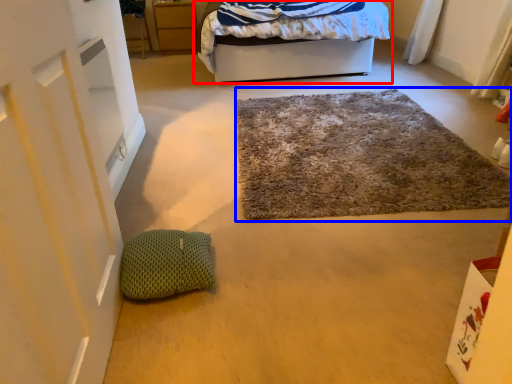
Question: Which object is further to the camera taking this photo, bed (highlighted by a red box) or door (highlighted by a blue box)?

Choices:
 (A) bed
 (B) door

Answer: (A)